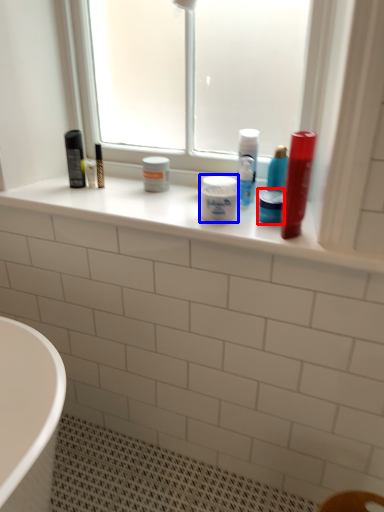
Question: Which object appears farthest to the camera in this image, mouthwash (highlighted by a red box) or toiletry (highlighted by a blue box)?

Choices:
 (A) mouthwash
 (B) toiletry

Answer: (A)